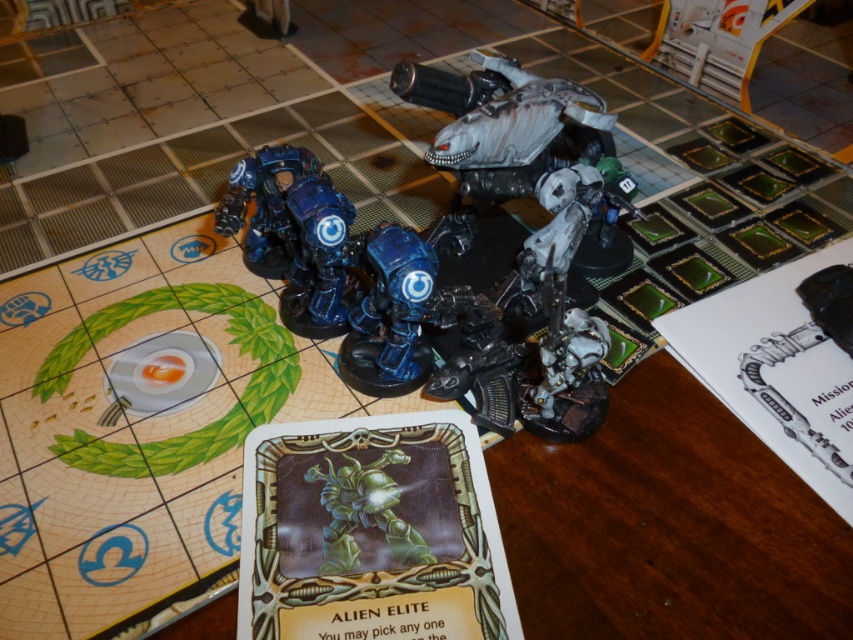
You are a player in a tabletop game trying to determine the best path for your miniatures. You have two points marked on the playmat at coordinates point [314,180] and point [396,394]. Which point is closer to your current position if you are standing behind both points?

Point [314,180] is in front of point [396,394], so if you are standing behind both points, the closer point would be point [396,394] because it is farther away from your position.

You are a photographer trying to capture a closeup of the blue metallic armor at center. You are currently holding the camera and standing 1 meter away from the armor. Can you get closer to take the photo without moving the camera?

The blue metallic armor at center and camera are 78.24 centimeters apart from each other. Since you are already 1 meter away, which is farther than the 78.24 cm distance, you can move closer to the blue metallic armor at center to take the photo without moving the camera.

You are a player trying to fit both the blue metallic armor at center and the blue metallic alien elite at center into a storage box that can only accommodate items up to the width of the wider of the two. Which miniature should you prioritize placing first to ensure it fits?

The blue metallic armor at center is wider than the blue metallic alien elite at center, so you should prioritize placing the blue metallic armor at center first to ensure it fits in the storage box.